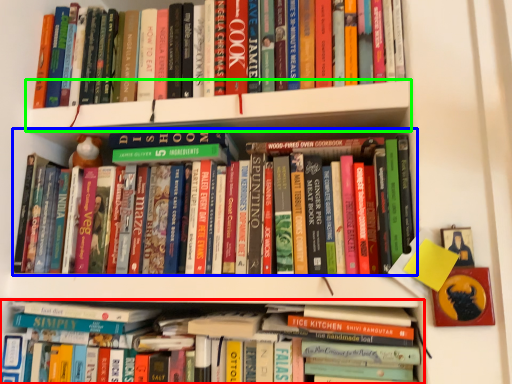
Question: Estimate the real-world distances between objects in this image. Which object is closer to book (highlighted by a red box), book (highlighted by a blue box) or shelf (highlighted by a green box)?

Choices:
 (A) book
 (B) shelf

Answer: (A)